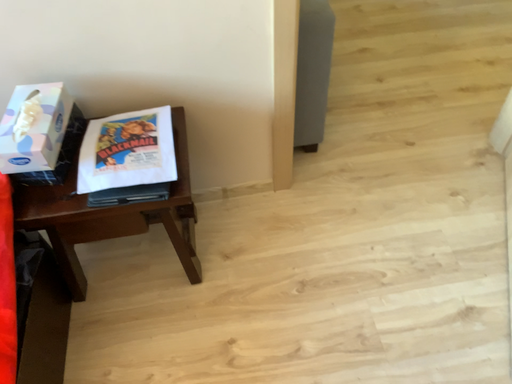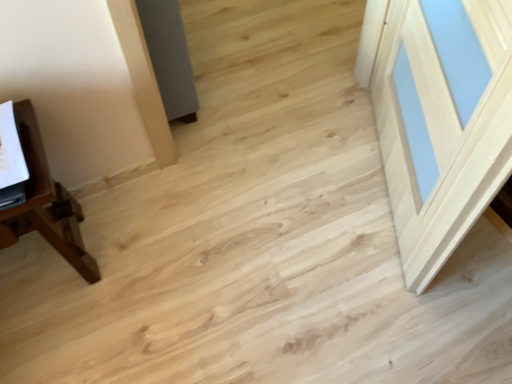
Question: How did the camera likely rotate when shooting the video?

Choices:
 (A) rotated left
 (B) rotated right

Answer: (B)